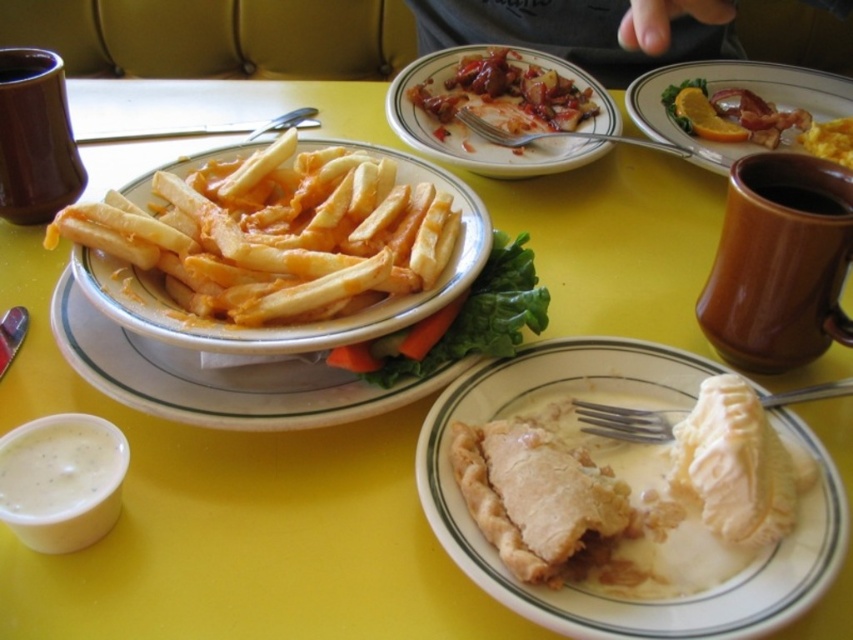
Is cheesy fried potatoes at center bigger than shiny red sauce at center?

Yes, cheesy fried potatoes at center is bigger than shiny red sauce at center.

Describe the element at coordinates (294, 324) in the screenshot. I see `cheesy fried potatoes at center` at that location.

Image resolution: width=853 pixels, height=640 pixels. In order to click on cheesy fried potatoes at center in this screenshot , I will do point(294,324).

At what (x,y) coordinates should I click in order to perform the action: click on cheesy fried potatoes at center. Please return your answer as a coordinate pair (x, y). Looking at the image, I should click on (294, 324).

Can you confirm if shiny red sauce at center is thinner than golden crispy fries at center?

Incorrect, shiny red sauce at center's width is not less than golden crispy fries at center's.

From the picture: Which of these two, shiny red sauce at center or golden crispy fries at center, stands taller?

shiny red sauce at center is taller.

Find the location of a particular element. shiny red sauce at center is located at coordinates (503, 99).

Can you confirm if matte white pie at center is positioned to the right of cheesy fried potatoes at center?

Yes, matte white pie at center is to the right of cheesy fried potatoes at center.

You are a GUI agent. You are given a task and a screenshot of the screen. Output one action in this format:
    pyautogui.click(x=<x>, y=<y>)
    Task: Click on the matte white pie at center
    The width and height of the screenshot is (853, 640).
    Given the screenshot: What is the action you would take?
    pyautogui.click(x=646, y=401)